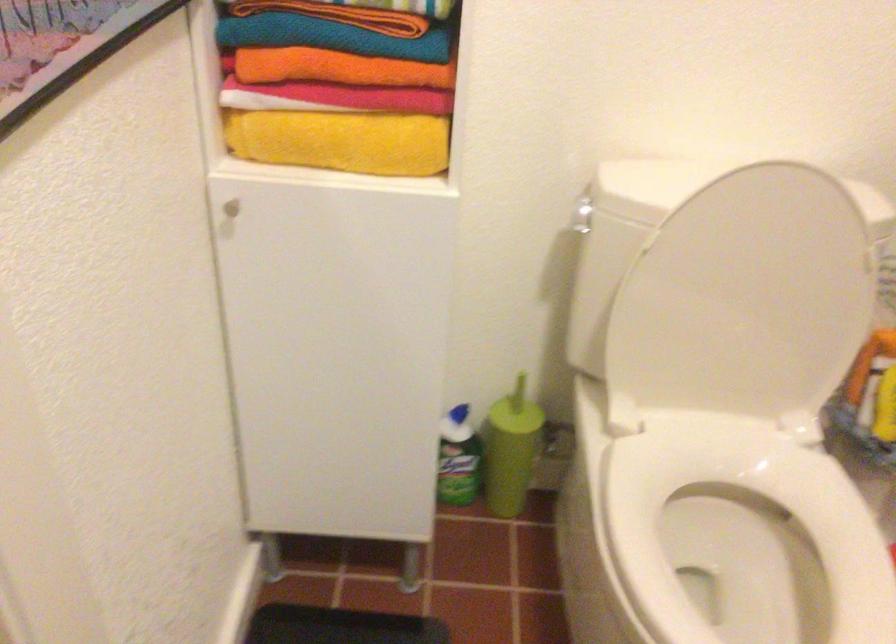
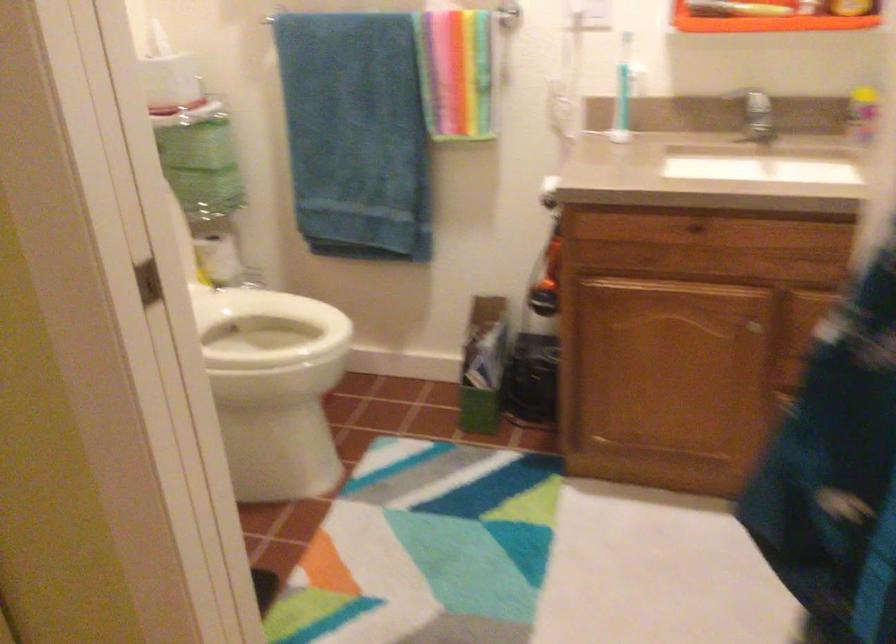
Question: I am providing you with two images of the same scene from different viewpoints. After the viewpoint changes to image2, which objects are now occluded?

Choices:
 (A) card reader slot
 (B) cabinet drawer knob
 (C) cabinet door knob
 (D) white toilet lid

Answer: (D)